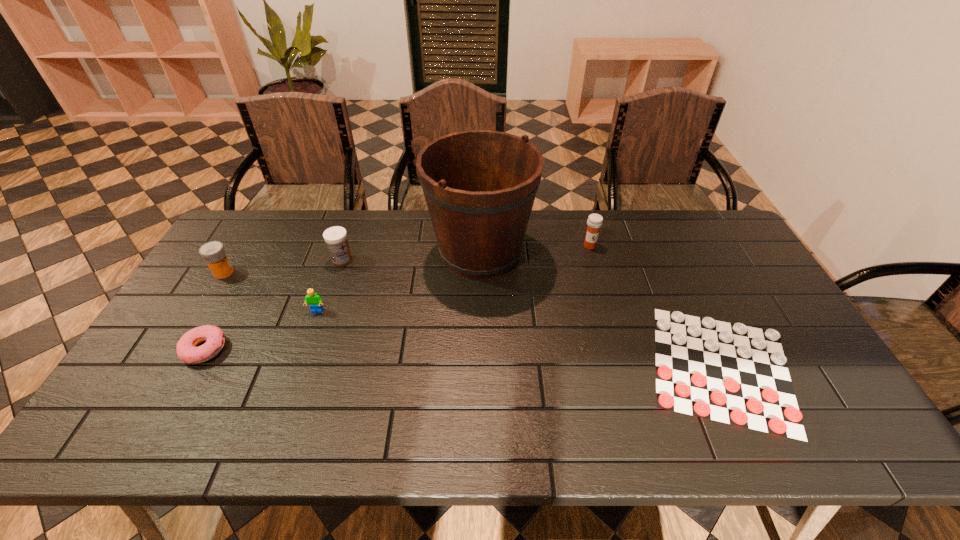
Where is `bucket`? bucket is located at coordinates (479, 185).

You are a GUI agent. You are given a task and a screenshot of the screen. Output one action in this format:
    pyautogui.click(x=<x>, y=<y>)
    Task: Click on the fifth object from left to right
    This screenshot has width=960, height=540.
    Given the screenshot: What is the action you would take?
    pyautogui.click(x=479, y=185)

Image resolution: width=960 pixels, height=540 pixels. Find the location of `the sixth object from left to right`. the sixth object from left to right is located at coordinates (594, 222).

Find the location of a particular element. The height and width of the screenshot is (540, 960). the farthest medicine is located at coordinates (594, 222).

Locate an element on the screen. The height and width of the screenshot is (540, 960). the second medicine from right to left is located at coordinates (335, 237).

Where is `the leftmost medicine`? Image resolution: width=960 pixels, height=540 pixels. the leftmost medicine is located at coordinates (213, 253).

The height and width of the screenshot is (540, 960). In order to click on Lego in this screenshot , I will do `click(313, 299)`.

This screenshot has height=540, width=960. Identify the location of the second shortest object. (187, 351).

Where is `the shortest object`? The width and height of the screenshot is (960, 540). the shortest object is located at coordinates (731, 373).

Identify the location of the rightmost object. (731, 373).